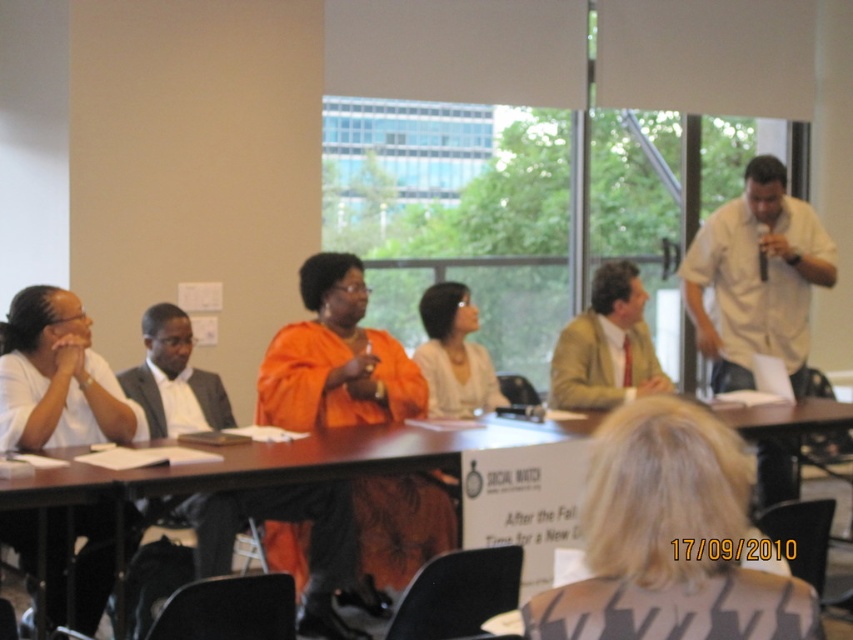
Who is positioned more to the right, white shirt at right or wooden table at center?

white shirt at right

Between white shirt at right and wooden table at center, which one has less height?

wooden table at center

Between point (717, 275) and point (132, 476), which one is positioned in front?

Positioned in front is point (132, 476).

The width and height of the screenshot is (853, 640). What are the coordinates of `white shirt at right` in the screenshot? It's located at (756, 278).

Between point (787, 252) and point (621, 396), which one is positioned behind?

The point (787, 252) is more distant.

Is white shirt at right wider than light brown leather jacket at center?

Yes, white shirt at right is wider than light brown leather jacket at center.

The image size is (853, 640). I want to click on white shirt at right, so click(756, 278).

Which is in front, point (780, 426) or point (569, 337)?

Point (780, 426) is more forward.

Describe the element at coordinates (279, 461) in the screenshot. I see `wooden table at center` at that location.

Does point (236, 468) come behind point (606, 342)?

No, (236, 468) is closer to viewer.

This screenshot has height=640, width=853. Identify the location of wooden table at center. (279, 461).